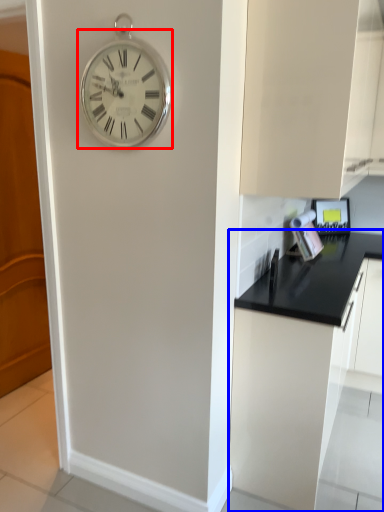
Question: Which point is further to the camera, wall clock (highlighted by a red box) or cabinetry (highlighted by a blue box)?

Choices:
 (A) wall clock
 (B) cabinetry

Answer: (B)